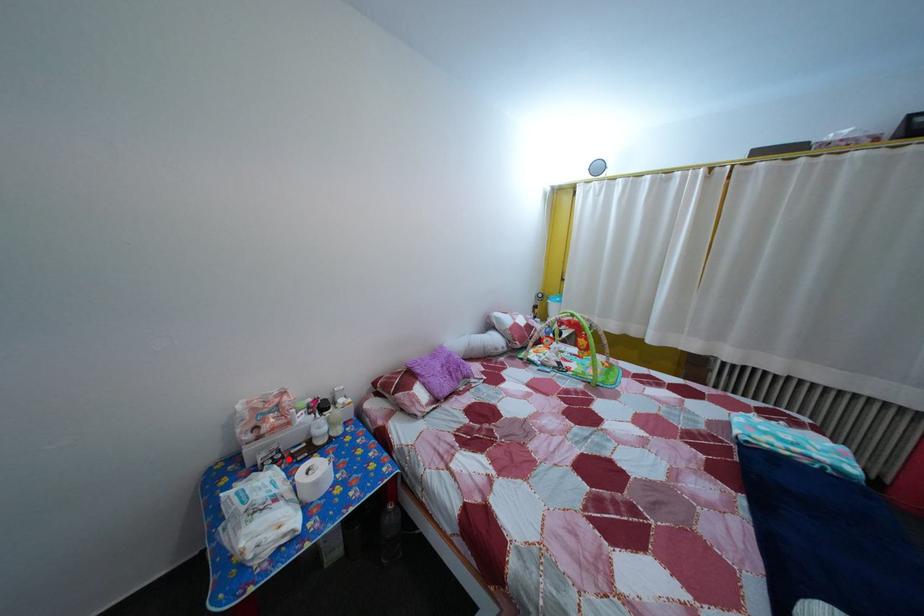
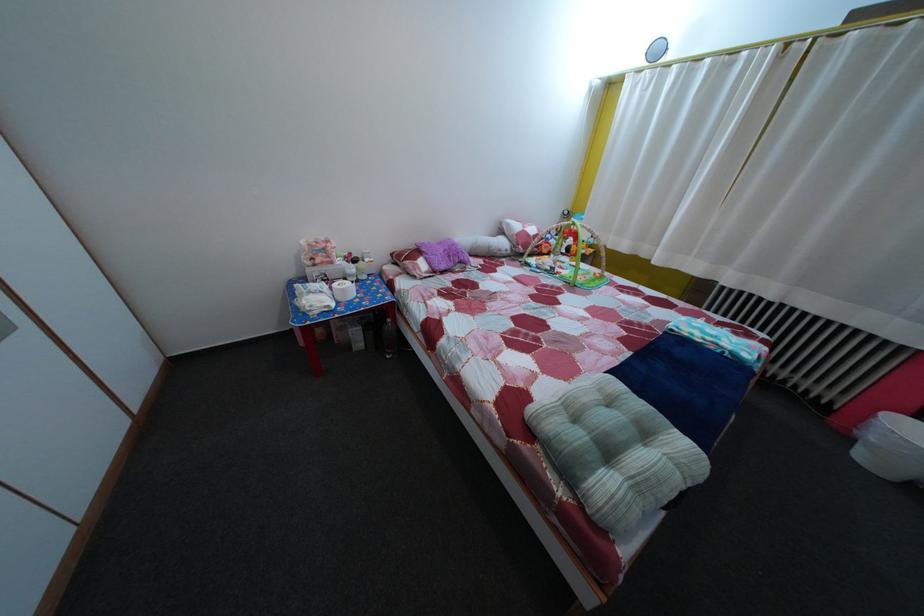
Find the pixel in the second image that matches the highlighted location in the first image.

(335, 284)